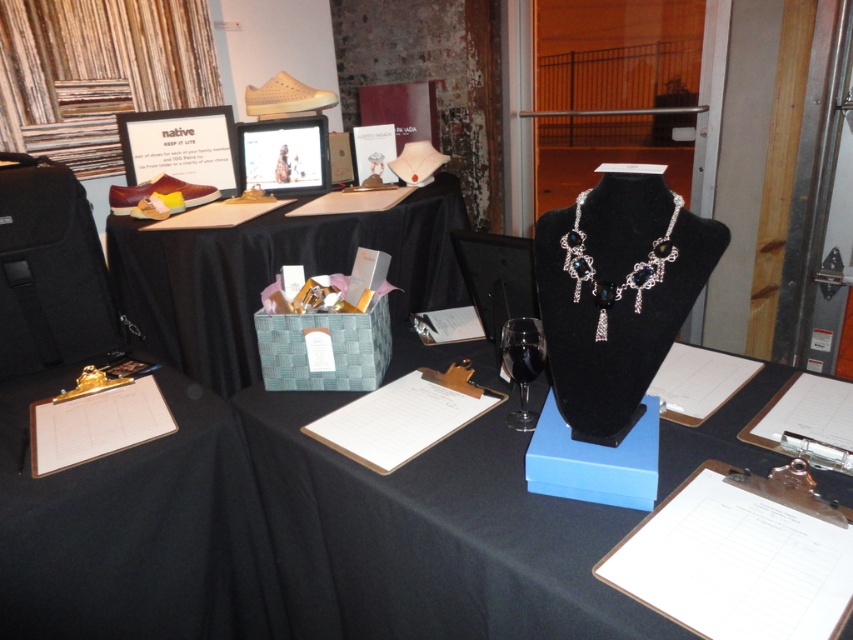
Question: Is black velvet necklace at center above transparent glass wine glass at center?

Choices:
 (A) yes
 (B) no

Answer: (B)

Question: Does woven fabric basket at center have a greater width compared to gold metal clipboard at lower left?

Choices:
 (A) yes
 (B) no

Answer: (A)

Question: Can you confirm if gold metal clipboard at lower left is bigger than transparent glass wine glass at center?

Choices:
 (A) no
 (B) yes

Answer: (B)

Question: Which of the following is the closest to the observer?

Choices:
 (A) black velvet necklace at center
 (B) gold metal clipboard at lower left

Answer: (A)

Question: Which object is the closest to the transparent glass wine glass at center?

Choices:
 (A) black velvet necklace at center
 (B) white paper clipboard at center

Answer: (B)

Question: Which point is farther to the camera?

Choices:
 (A) white paper clipboard at center
 (B) black fabric clipboard at lower left
 (C) silver metallic necklace at center-right
 (D) woven fabric basket at center

Answer: (D)